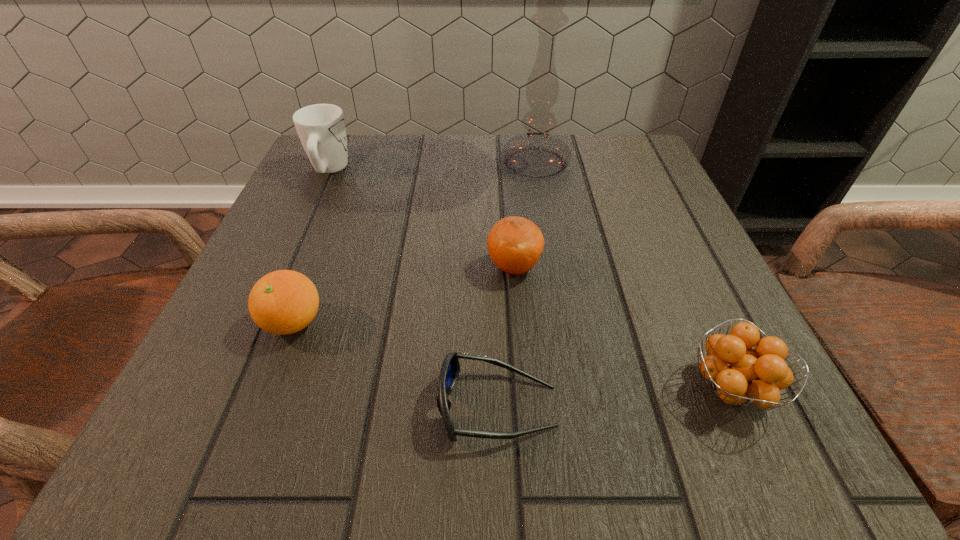
At what (x,y) coordinates should I click in order to perform the action: click on table lamp. Please return your answer as a coordinate pair (x, y). Image resolution: width=960 pixels, height=540 pixels. Looking at the image, I should click on (537, 154).

At what (x,y) coordinates should I click in order to perform the action: click on the second tallest object. Please return your answer as a coordinate pair (x, y). Looking at the image, I should click on click(x=321, y=128).

At what (x,y) coordinates should I click in order to perform the action: click on the third farthest object. Please return your answer as a coordinate pair (x, y). Looking at the image, I should click on (515, 244).

Identify the location of the farthest orange fruit. (515, 244).

The image size is (960, 540). Find the location of `the second farthest orange fruit`. the second farthest orange fruit is located at coordinates (283, 302).

At what (x,y) coordinates should I click in order to perform the action: click on the fourth farthest object. Please return your answer as a coordinate pair (x, y). Looking at the image, I should click on (283, 302).

This screenshot has width=960, height=540. Find the location of `the rightmost object`. the rightmost object is located at coordinates (738, 373).

The width and height of the screenshot is (960, 540). Find the location of `the nearest orange fruit`. the nearest orange fruit is located at coordinates (738, 373).

Where is `sunglasses`? sunglasses is located at coordinates pos(450,369).

This screenshot has width=960, height=540. I want to click on free space located 0.060m on the front-facing side of the tallest object, so click(x=544, y=214).